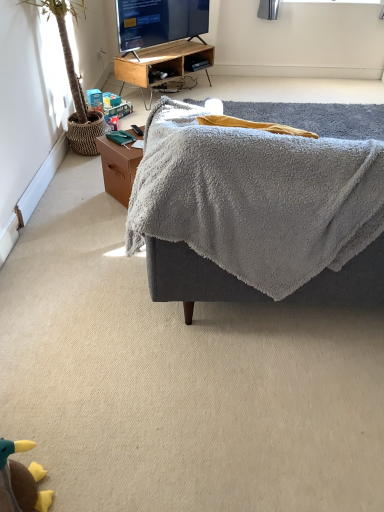
Question: Relative to plush yellow duck at lower left, is green leafy plant at left in front or behind?

Choices:
 (A) behind
 (B) front

Answer: (A)

Question: Is green leafy plant at left wider or thinner than plush yellow duck at lower left?

Choices:
 (A) wide
 (B) thin

Answer: (A)

Question: Based on their relative distances, which object is farther from the plush yellow duck at lower left?

Choices:
 (A) green leafy plant at left
 (B) woodendesk at upper center
 (C) brown wooden side table at lower left
 (D) matte black tv at upper center
 (E) gray fuzzy ottoman at center

Answer: (D)

Question: Which is farther from the green leafy plant at left?

Choices:
 (A) matte black tv at upper center
 (B) woodendesk at upper center
 (C) gray fuzzy ottoman at center
 (D) brown wooden side table at lower left
 (E) plush yellow duck at lower left

Answer: (E)